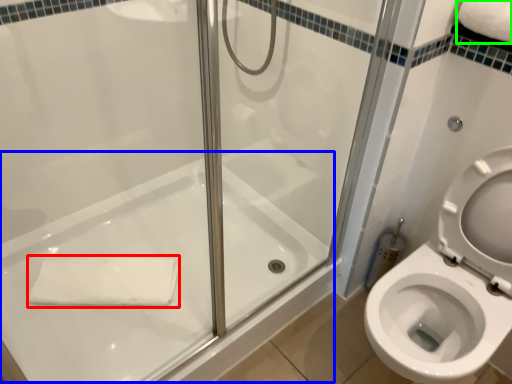
Question: Which object is the farthest from bath towel (highlighted by a red box)? Choose among these: bath (highlighted by a blue box) or bath towel (highlighted by a green box).

Choices:
 (A) bath
 (B) bath towel

Answer: (B)